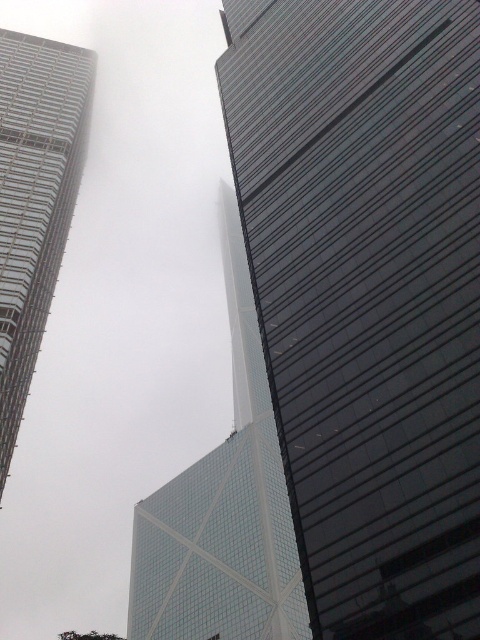
Question: Is glassy reflective skyscraper at right above transparent glass tower at center?

Choices:
 (A) yes
 (B) no

Answer: (A)

Question: Which is farther from the transparent glass tower at center?

Choices:
 (A) glassy reflective skyscraper at right
 (B) glassy steel skyscraper at left

Answer: (A)

Question: From the image, what is the correct spatial relationship of transparent glass tower at center in relation to glassy steel skyscraper at left?

Choices:
 (A) right
 (B) left

Answer: (A)

Question: Considering the real-world distances, which object is farthest from the glassy steel skyscraper at left?

Choices:
 (A) transparent glass tower at center
 (B) glassy reflective skyscraper at right

Answer: (A)

Question: Which object appears closest to the camera in this image?

Choices:
 (A) glassy steel skyscraper at left
 (B) transparent glass tower at center
 (C) glassy reflective skyscraper at right

Answer: (C)

Question: Is glassy reflective skyscraper at right positioned behind transparent glass tower at center?

Choices:
 (A) no
 (B) yes

Answer: (A)